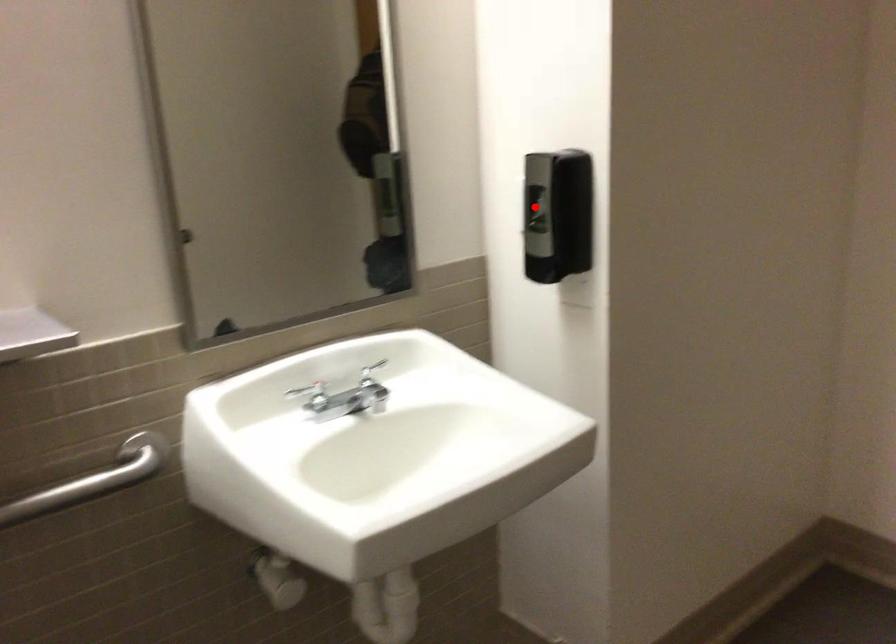
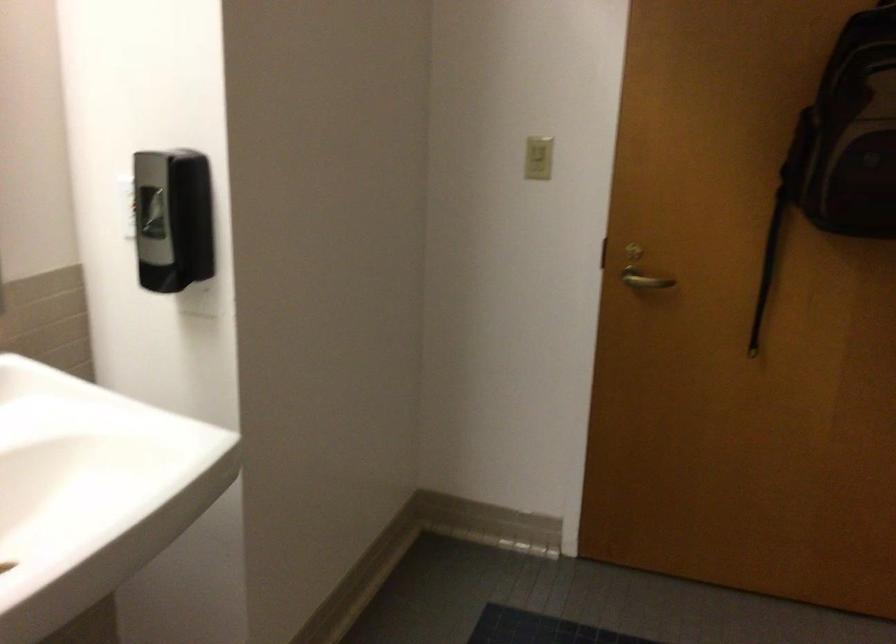
Locate, in the second image, the point that corresponds to the highlighted location in the first image.

(150, 212)